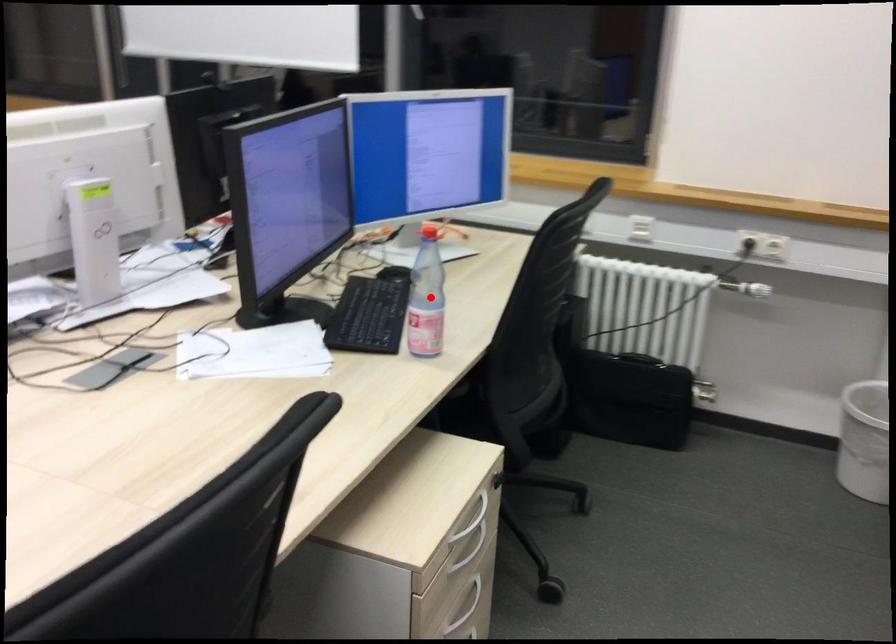
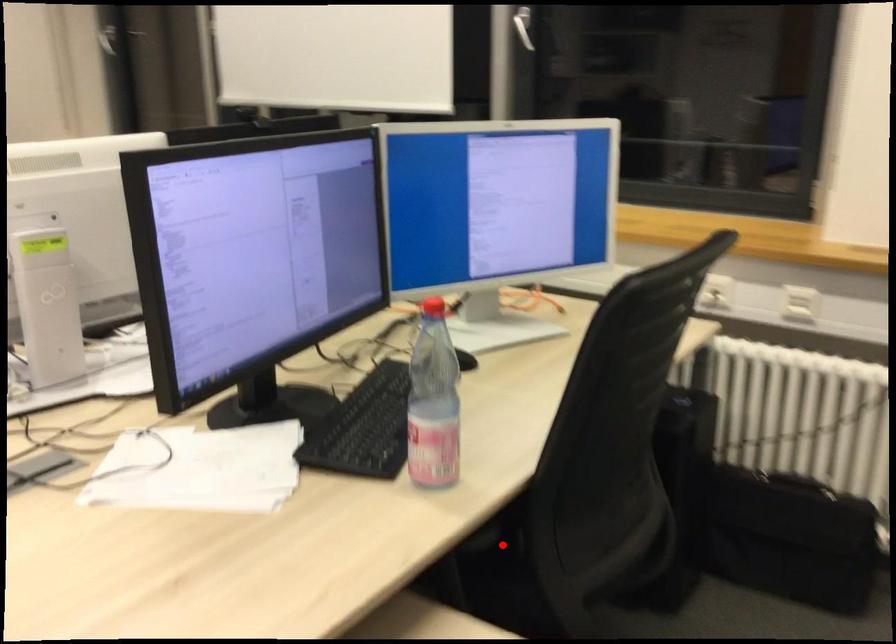
I am providing you with two images of the same scene from different viewpoints. A red point is marked on the first image and another point is marked on the second image. Do the highlighted points in image1 and image2 indicate the same real-world spot?

No